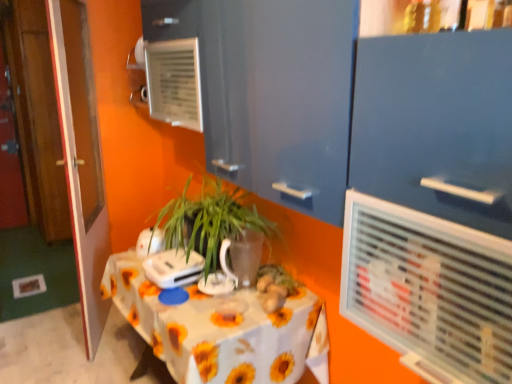
Question: Is white glossy kettle at upper center, placed as the 2th appliance when sorted from front to back, shorter than white plastic appliance at center, arranged as the 1th appliance when viewed from the front?

Choices:
 (A) no
 (B) yes

Answer: (A)

Question: Is white glossy kettle at upper center, placed as the 2th appliance when sorted from front to back, far from white plastic appliance at center, arranged as the 1th appliance when viewed from the front?

Choices:
 (A) no
 (B) yes

Answer: (A)

Question: Is white glossy kettle at upper center, placed as the 2th appliance when sorted from front to back, looking in the opposite direction of white plastic appliance at center, arranged as the 1th appliance when viewed from the front?

Choices:
 (A) no
 (B) yes

Answer: (A)

Question: Is white glossy kettle at upper center, placed as the 2th appliance when sorted from front to back, behind white plastic appliance at center, arranged as the 1th appliance when viewed from the front?

Choices:
 (A) yes
 (B) no

Answer: (A)

Question: Is white glossy kettle at upper center, which is the first appliance in back-to-front order, bigger than white plastic appliance at center, the 2th appliance viewed from the back?

Choices:
 (A) no
 (B) yes

Answer: (A)

Question: Looking at their shapes, would you say translucent glass vase at center is wider or thinner than white glossy kettle at upper center, which is the first appliance in back-to-front order?

Choices:
 (A) thin
 (B) wide

Answer: (B)

Question: Is translucent glass vase at center bigger or smaller than white glossy kettle at upper center, placed as the 2th appliance when sorted from front to back?

Choices:
 (A) small
 (B) big

Answer: (B)

Question: From a real-world perspective, is translucent glass vase at center positioned above or below white glossy kettle at upper center, which is the first appliance in back-to-front order?

Choices:
 (A) above
 (B) below

Answer: (A)

Question: In the image, is translucent glass vase at center on the left side or the right side of white glossy kettle at upper center, which is the first appliance in back-to-front order?

Choices:
 (A) left
 (B) right

Answer: (B)

Question: Is point (148, 251) closer or farther from the camera than point (84, 215)?

Choices:
 (A) closer
 (B) farther

Answer: (A)

Question: In the image, is white glossy kettle at upper center, placed as the 2th appliance when sorted from front to back, on the left side or the right side of wooden door at left?

Choices:
 (A) right
 (B) left

Answer: (A)

Question: Looking at their shapes, would you say white glossy kettle at upper center, placed as the 2th appliance when sorted from front to back, is wider or thinner than wooden door at left?

Choices:
 (A) wide
 (B) thin

Answer: (B)

Question: Is white glossy kettle at upper center, which is the first appliance in back-to-front order, taller or shorter than wooden door at left?

Choices:
 (A) short
 (B) tall

Answer: (A)

Question: In the image, is white plastic air conditioning unit at upper center on the left side or the right side of matte blue cabinet at upper center?

Choices:
 (A) right
 (B) left

Answer: (A)

Question: In terms of width, does white plastic air conditioning unit at upper center look wider or thinner when compared to matte blue cabinet at upper center?

Choices:
 (A) thin
 (B) wide

Answer: (A)